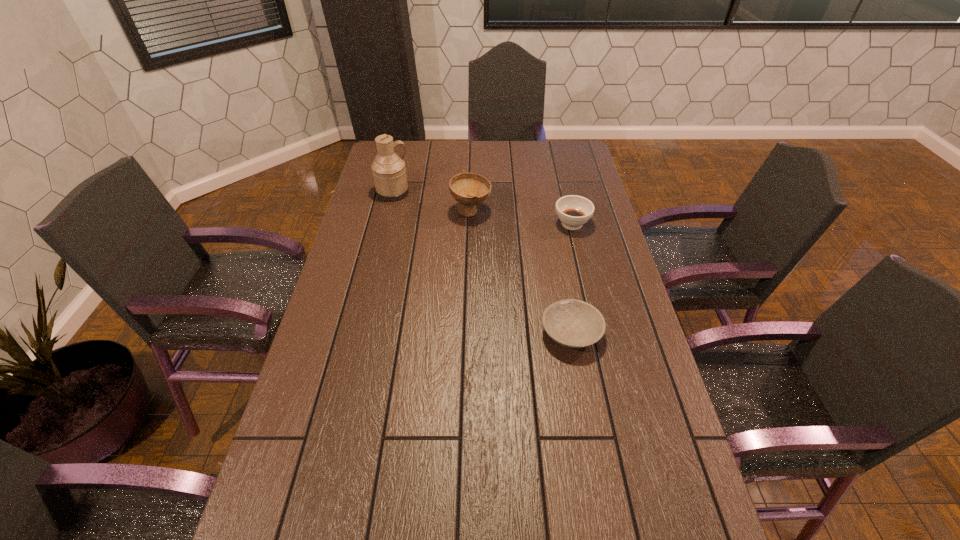
Image resolution: width=960 pixels, height=540 pixels. I want to click on vacant space that satisfies the following two spatial constraints: 1. on the front side of the pitcher; 2. on the right side of the shortest object, so click(359, 333).